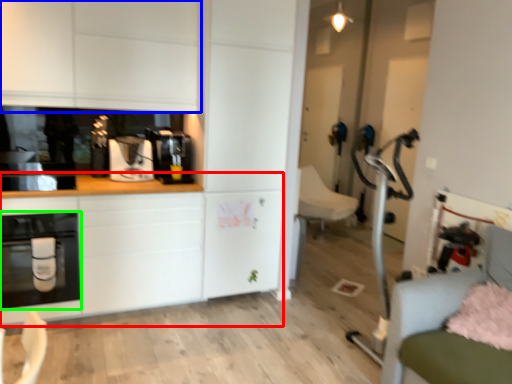
Question: Considering the real-world distances, which object is closest to counter top (highlighted by a red box)? cabinetry (highlighted by a blue box) or home appliance (highlighted by a green box).

Choices:
 (A) cabinetry
 (B) home appliance

Answer: (B)